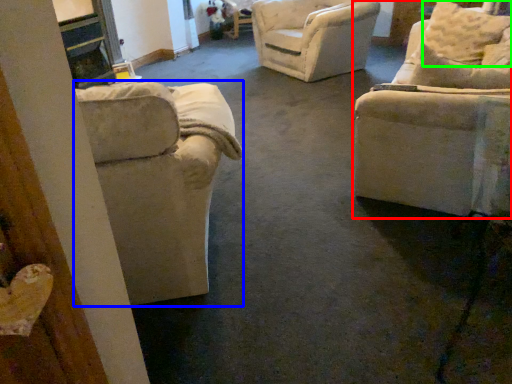
Question: Based on their relative distances, which object is farther from chair (highlighted by a red box)? Choose from chair (highlighted by a blue box) and pillow (highlighted by a green box).

Choices:
 (A) chair
 (B) pillow

Answer: (B)